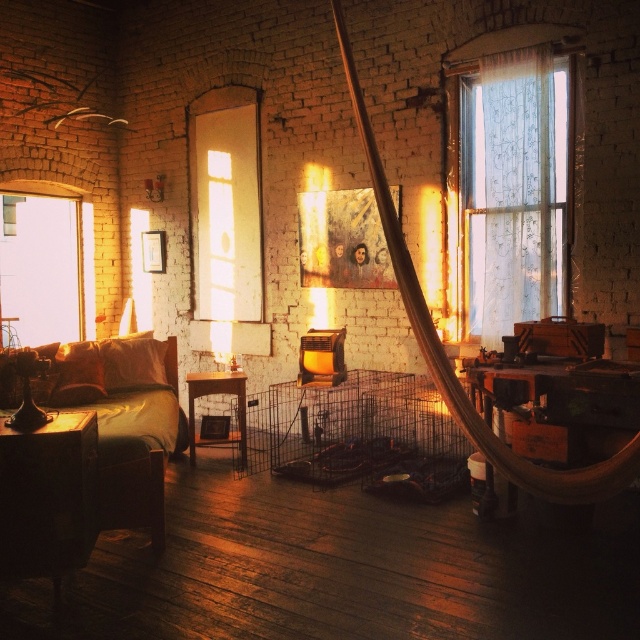
Is dark wood nightstand at lower left shorter than transparent glass window at left?

Correct, dark wood nightstand at lower left is not as tall as transparent glass window at left.

Is dark wood nightstand at lower left positioned in front of transparent glass window at left?

That is True.

Where is `dark wood nightstand at lower left`? dark wood nightstand at lower left is located at coordinates (48, 497).

At what (x,y) coordinates should I click in order to perform the action: click on dark wood nightstand at lower left. Please return your answer as a coordinate pair (x, y). This screenshot has width=640, height=640. Looking at the image, I should click on (48, 497).

Between point (369, 461) and point (150, 492), which one is positioned in front?

Point (150, 492) is in front.

Does point (346, 422) lie behind point (154, 465)?

Yes, it is.

Identify the location of black wire cage at center. (358, 433).

Is point (40, 563) closer to camera compared to point (145, 484)?

Yes, it is.

The width and height of the screenshot is (640, 640). What do you see at coordinates (48, 497) in the screenshot? I see `dark wood nightstand at lower left` at bounding box center [48, 497].

Image resolution: width=640 pixels, height=640 pixels. I want to click on dark wood nightstand at lower left, so click(48, 497).